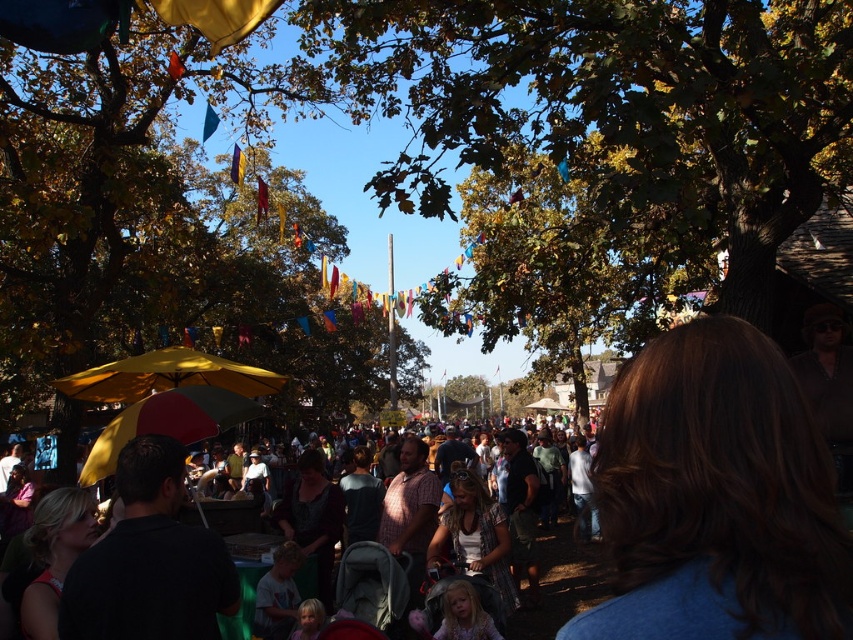
You are at the festival and want to find the person with dark brown hair at lower left. Which direction should you look relative to the yellow matte umbrella at center?

The dark brown hair at lower left is positioned on the right side of the yellow matte umbrella at center, so you should look to the right of the yellow matte umbrella at center to find the person with dark brown hair at lower left.

Looking at this image, you are at the festival and want to find shade. You see the green leafy tree at center and the brown hair at center. Which one is above the other?

The green leafy tree at center is positioned over brown hair at center.